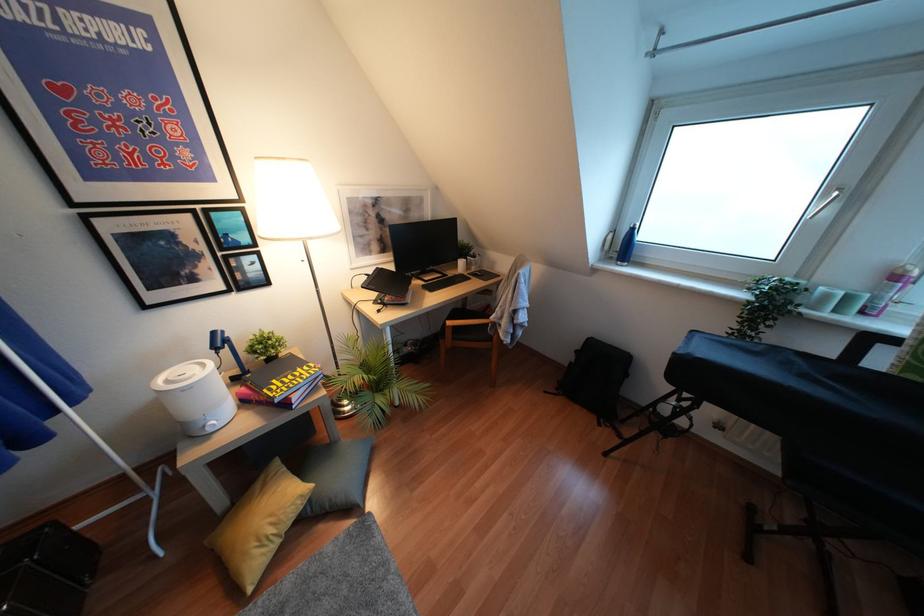
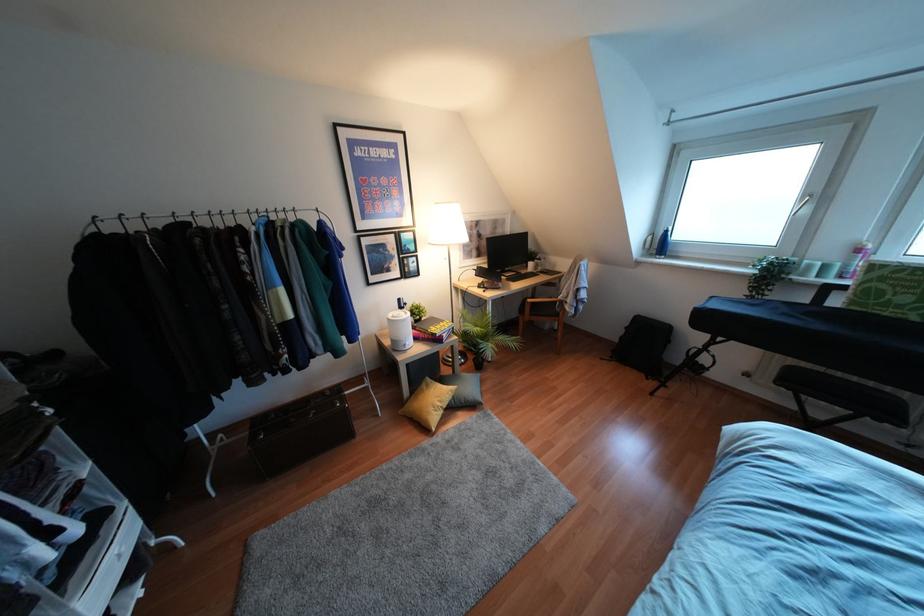
Find the pixel in the second image that matches [310,500] in the first image.

(453, 397)